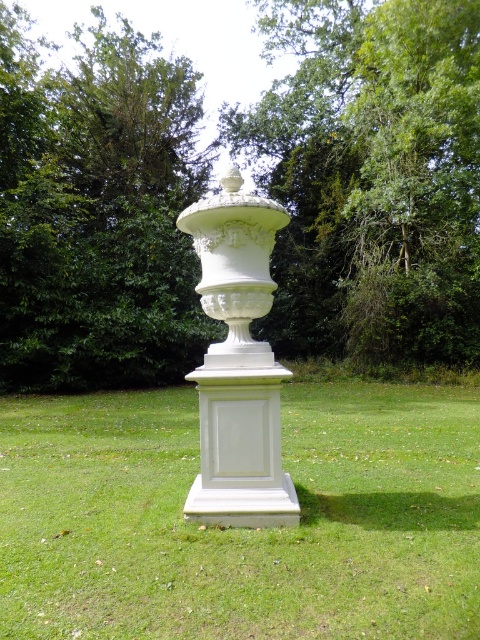
Question: Is green leafy tree at center further to the viewer compared to white smooth pedestal at center?

Choices:
 (A) no
 (B) yes

Answer: (B)

Question: Which point is closer to the camera?

Choices:
 (A) green leafy tree at center
 (B) white smooth pedestal at center
 (C) white glossy urn at center
 (D) green leafy tree at upper left

Answer: (B)

Question: Can you confirm if white smooth pedestal at center is bigger than white glossy urn at center?

Choices:
 (A) yes
 (B) no

Answer: (A)

Question: Which of the following is the closest to the observer?

Choices:
 (A) (87, 266)
 (B) (157, 122)

Answer: (A)

Question: Which point appears closest to the camera in this image?

Choices:
 (A) [x=204, y=464]
 (B) [x=409, y=467]

Answer: (A)

Question: Is white smooth pedestal at center smaller than green leafy tree at upper left?

Choices:
 (A) yes
 (B) no

Answer: (A)